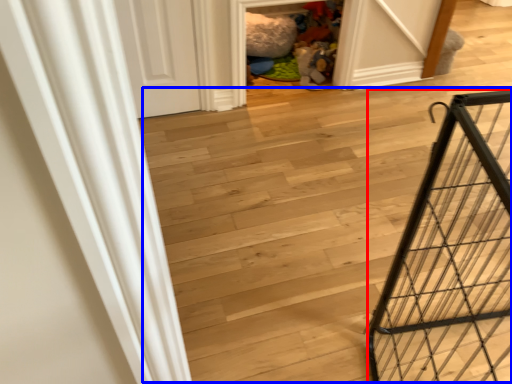
Question: Which of the following is the farthest to the observer, cage (highlighted by a red box) or stairwell (highlighted by a blue box)?

Choices:
 (A) cage
 (B) stairwell

Answer: (B)